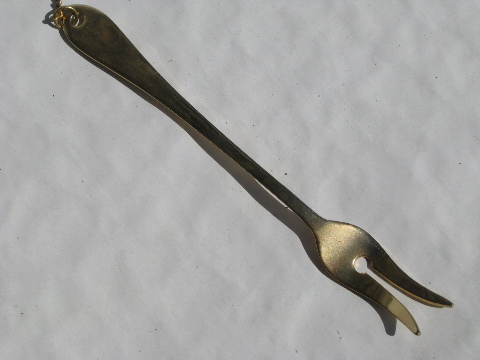
Identify the location of handle. (196, 122).